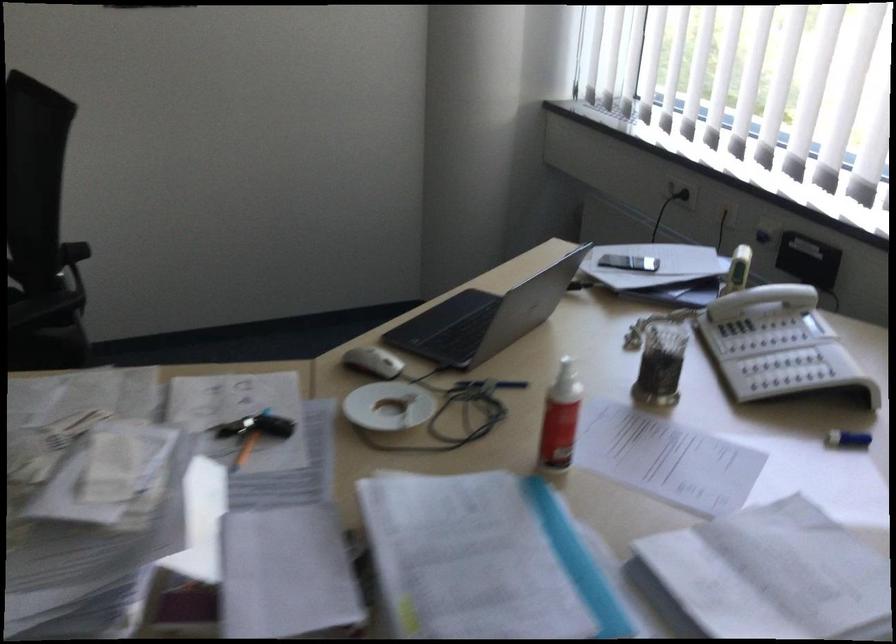
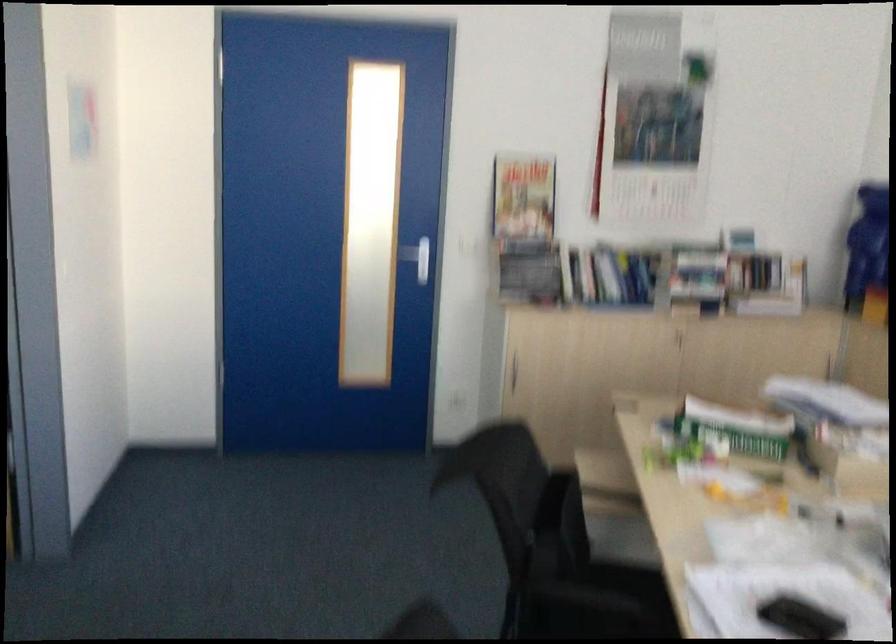
First-person continuous shooting, in which direction is the camera rotating?

The camera rotated toward left-down.